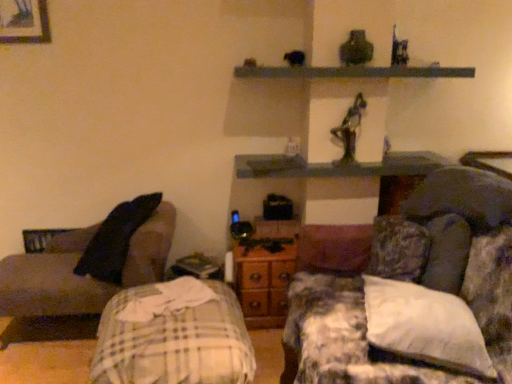
Image resolution: width=512 pixels, height=384 pixels. Find the location of `blank space situated above wooden dresser at center (from a real-world perspective)`. blank space situated above wooden dresser at center (from a real-world perspective) is located at coordinates (264, 243).